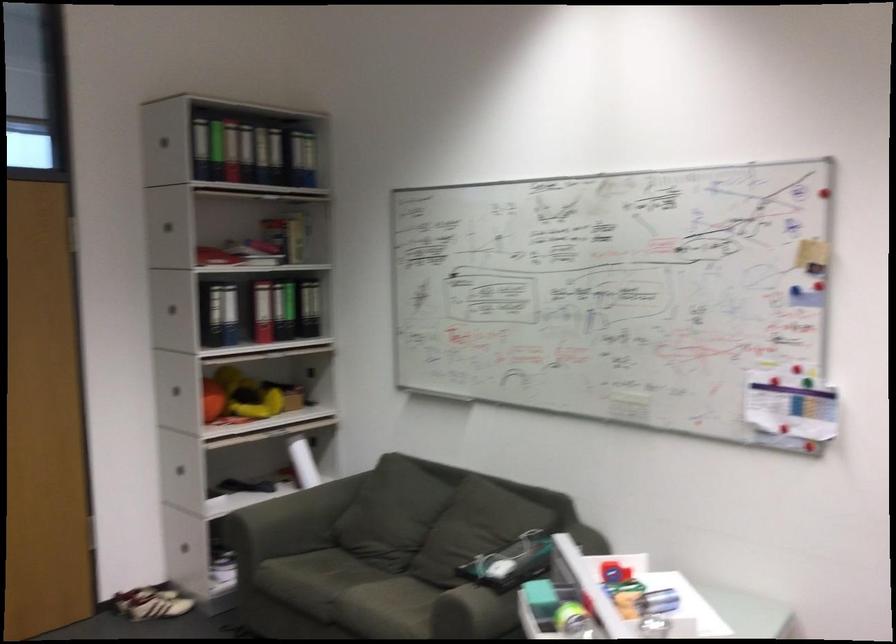
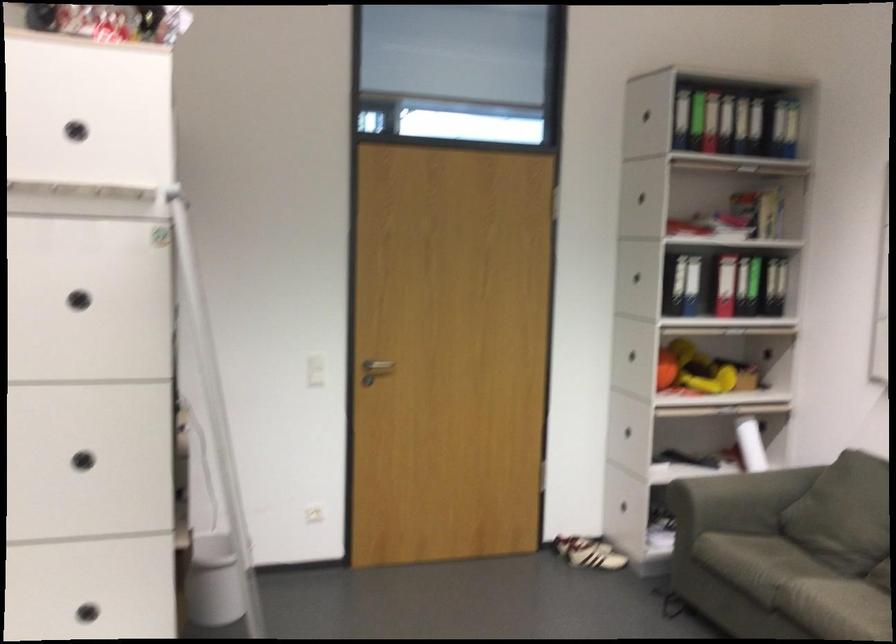
Locate, in the second image, the point that corresponds to [291,328] in the first image.

(757, 285)